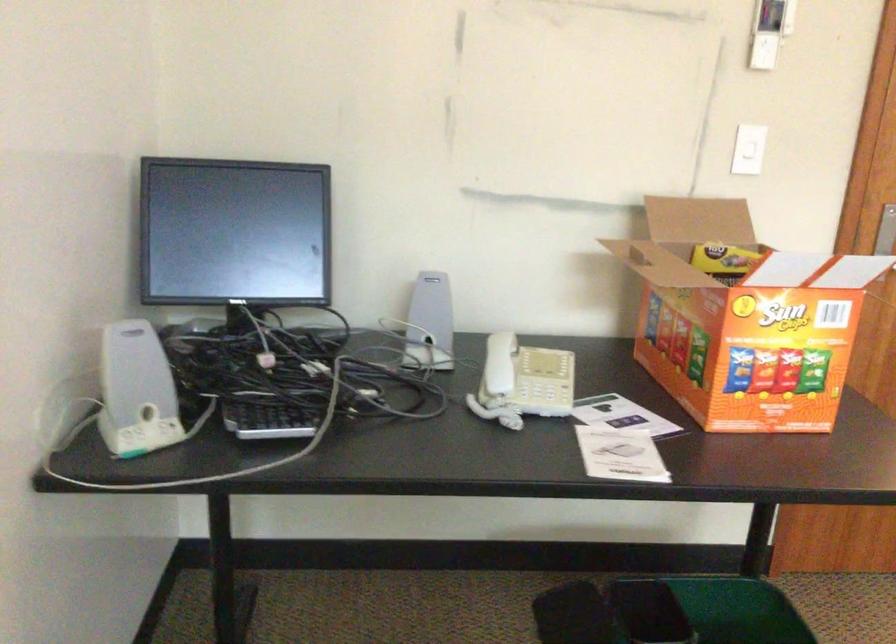
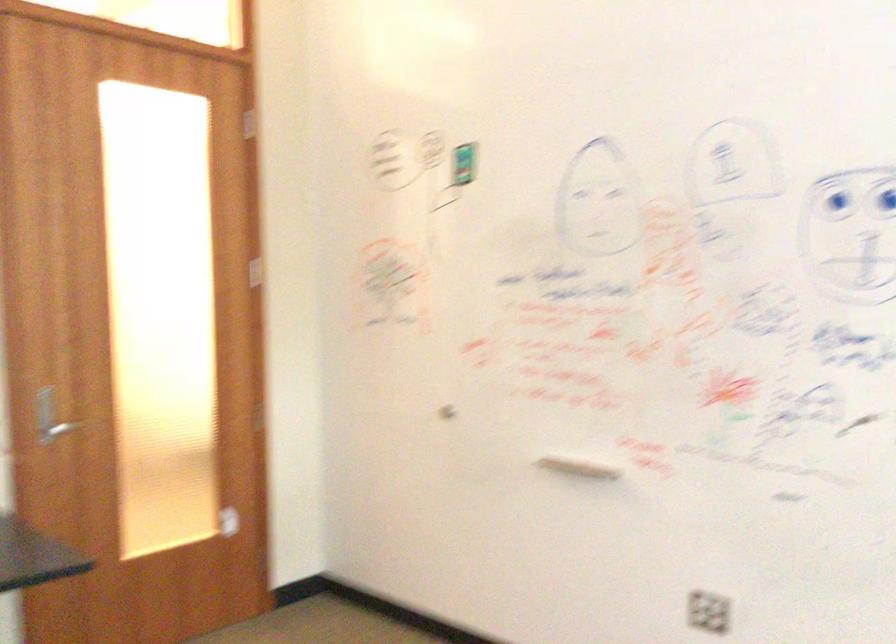
Question: The images are taken continuously from a first-person perspective. In which direction is your viewpoint rotating?

Choices:
 (A) Left
 (B) Right
 (C) Up
 (D) Down

Answer: (B)